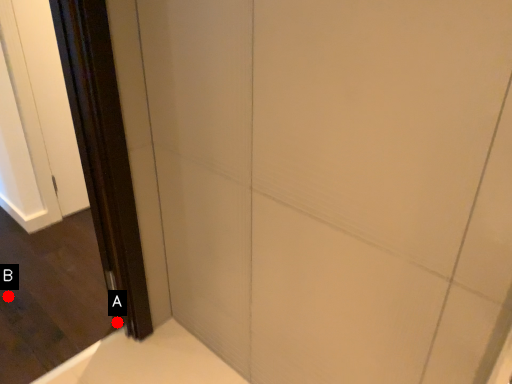
Question: Two points are circled on the image, labeled by A and B beside each circle. Which point appears farthest from the camera in this image?

Choices:
 (A) A is further
 (B) B is further

Answer: (B)